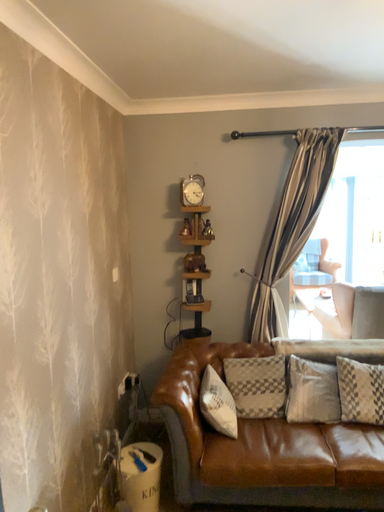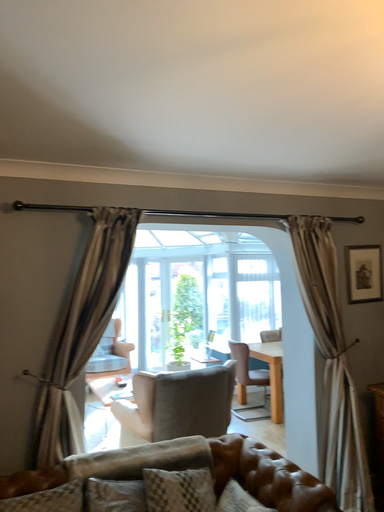
Question: Which way did the camera rotate in the video?

Choices:
 (A) rotated right
 (B) rotated left

Answer: (A)